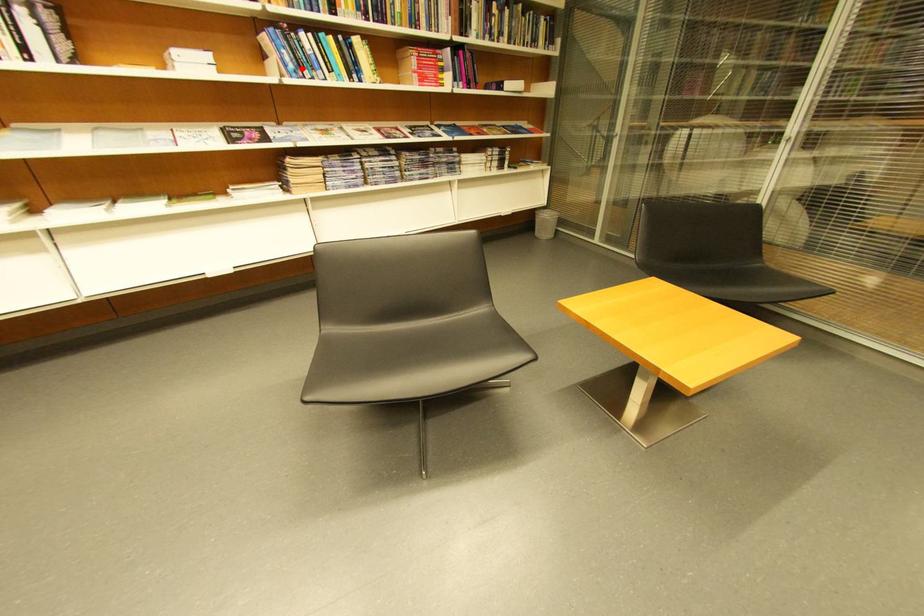
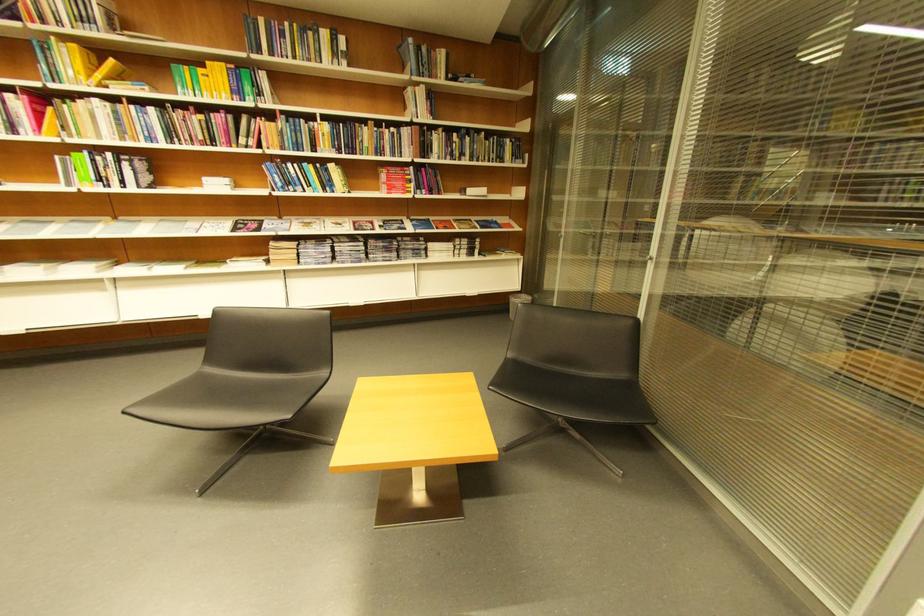
Question: I am providing you with two images of the same scene from different viewpoints. A red point is marked on the first image. At the location where the point appears in image 1, is it still visible in image 2?

Choices:
 (A) Yes
 (B) No

Answer: (A)